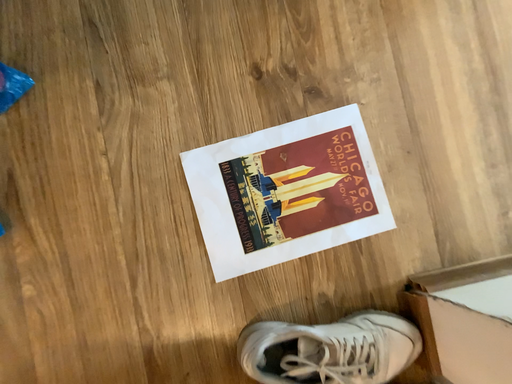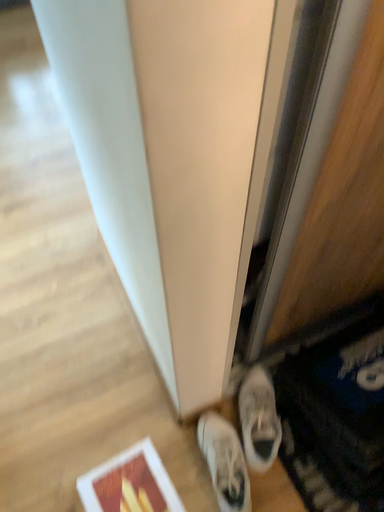
Question: Which way did the camera rotate in the video?

Choices:
 (A) rotated upward
 (B) rotated downward

Answer: (A)